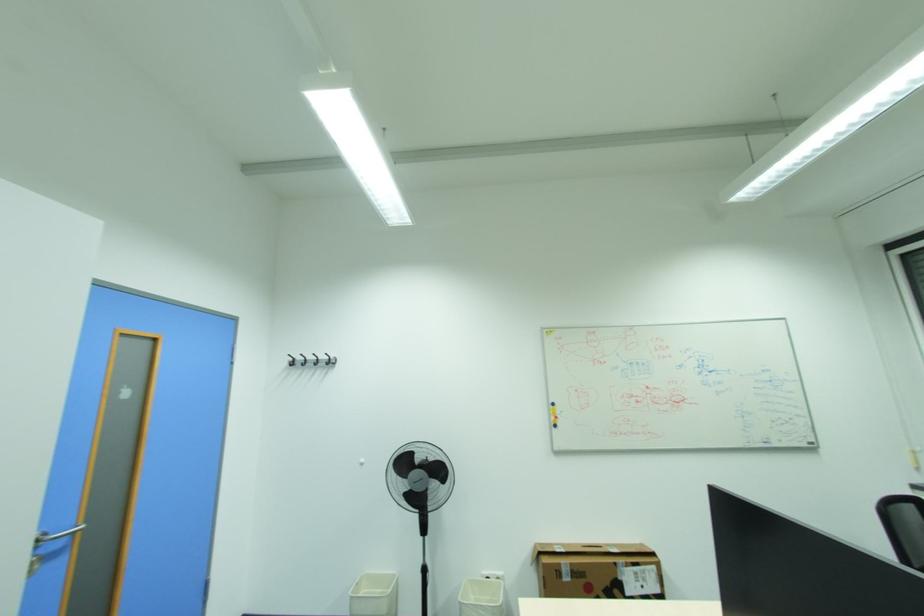
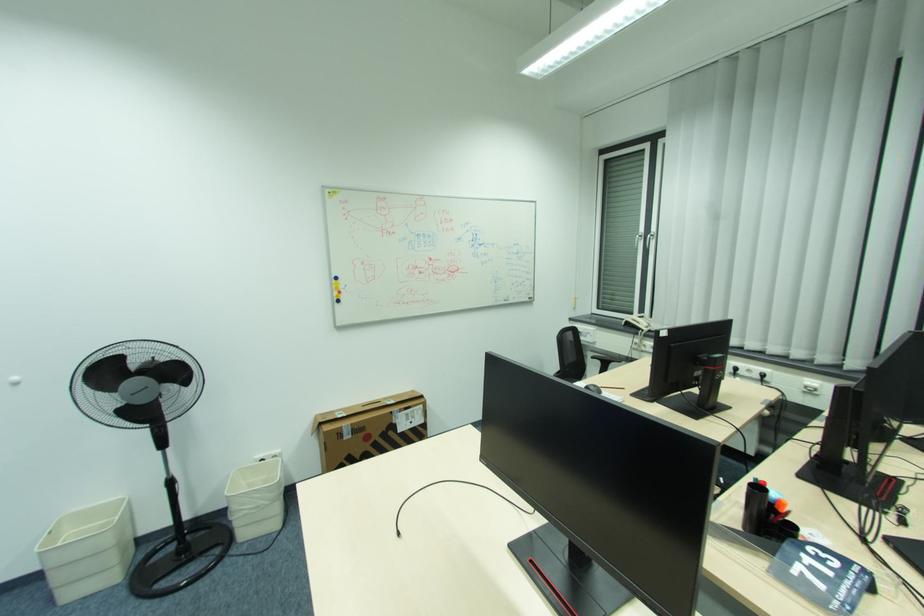
Where in the second image is the point corresponding to the point at 427,562 from the first image?

(169, 477)